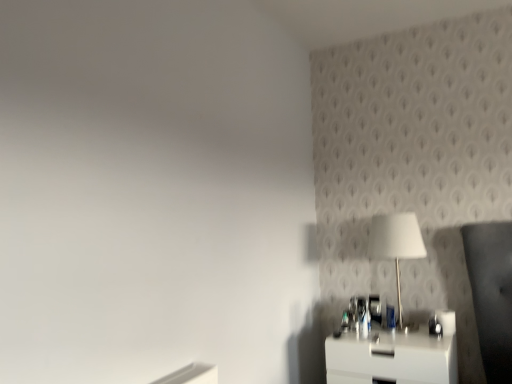
This screenshot has width=512, height=384. In order to click on white glossy nightstand at lower right in this screenshot , I will do coord(391,358).

This screenshot has height=384, width=512. Describe the element at coordinates (391, 358) in the screenshot. I see `white glossy nightstand at lower right` at that location.

The height and width of the screenshot is (384, 512). What do you see at coordinates (396, 241) in the screenshot?
I see `white glossy table lamp at upper right` at bounding box center [396, 241].

Where is `white glossy table lamp at upper right`? The image size is (512, 384). white glossy table lamp at upper right is located at coordinates (396, 241).

The image size is (512, 384). In order to click on white glossy nightstand at lower right in this screenshot , I will do `click(391, 358)`.

In the scene shown: Visually, is white glossy nightstand at lower right positioned to the left or to the right of white glossy table lamp at upper right?

In the image, white glossy nightstand at lower right appears on the left side of white glossy table lamp at upper right.

Is white glossy nightstand at lower right in front of white glossy table lamp at upper right?

Yes, the depth of white glossy nightstand at lower right is less than that of white glossy table lamp at upper right.

Which point is more distant from viewer, (451, 377) or (406, 223)?

Point (406, 223)

From the image's perspective, does white glossy nightstand at lower right appear higher than white glossy table lamp at upper right?

No, from the image's perspective, white glossy nightstand at lower right is not on top of white glossy table lamp at upper right.

From a real-world perspective, is white glossy nightstand at lower right located higher than white glossy table lamp at upper right?

No.

Which of these two, white glossy nightstand at lower right or white glossy table lamp at upper right, is wider?

white glossy nightstand at lower right.

Who is taller, white glossy nightstand at lower right or white glossy table lamp at upper right?

white glossy table lamp at upper right.

Between white glossy nightstand at lower right and white glossy table lamp at upper right, which one has smaller size?

Smaller between the two is white glossy table lamp at upper right.

Would you say white glossy nightstand at lower right is outside white glossy table lamp at upper right?

That's correct, white glossy nightstand at lower right is outside of white glossy table lamp at upper right.

Based on the photo, is white glossy nightstand at lower right touching white glossy table lamp at upper right?

white glossy nightstand at lower right and white glossy table lamp at upper right are clearly separated.

Is white glossy nightstand at lower right looking in the opposite direction of white glossy table lamp at upper right?

No, white glossy table lamp at upper right is not at the back of white glossy nightstand at lower right.

What's the angular difference between white glossy nightstand at lower right and white glossy table lamp at upper right's facing directions?

white glossy nightstand at lower right and white glossy table lamp at upper right are facing 0.987 degrees away from each other.

The image size is (512, 384). In order to click on nightstand in front of the white glossy table lamp at upper right in this screenshot , I will do `click(391, 358)`.

Can you confirm if white glossy table lamp at upper right is positioned to the left of white glossy nightstand at lower right?

In fact, white glossy table lamp at upper right is to the right of white glossy nightstand at lower right.

Considering the relative positions of white glossy table lamp at upper right and white glossy nightstand at lower right in the image provided, is white glossy table lamp at upper right in front of white glossy nightstand at lower right?

No, it is behind white glossy nightstand at lower right.

Which is nearer, (392, 220) or (398, 372)?

Point (392, 220) is positioned farther from the camera compared to point (398, 372).

From the image's perspective, between white glossy table lamp at upper right and white glossy nightstand at lower right, which one is located above?

white glossy table lamp at upper right, from the image's perspective.

From a real-world perspective, is white glossy table lamp at upper right above or below white glossy nightstand at lower right?

In terms of real-world spatial position, white glossy table lamp at upper right is above white glossy nightstand at lower right.

Between white glossy table lamp at upper right and white glossy nightstand at lower right, which one has larger width?

white glossy nightstand at lower right.

Consider the image. Between white glossy table lamp at upper right and white glossy nightstand at lower right, which one has less height?

With less height is white glossy nightstand at lower right.

Considering the relative sizes of white glossy table lamp at upper right and white glossy nightstand at lower right in the image provided, is white glossy table lamp at upper right smaller than white glossy nightstand at lower right?

Correct, white glossy table lamp at upper right occupies less space than white glossy nightstand at lower right.

Is white glossy table lamp at upper right located outside white glossy nightstand at lower right?

white glossy table lamp at upper right is positioned outside white glossy nightstand at lower right.

Is white glossy table lamp at upper right far from white glossy nightstand at lower right?

No, white glossy table lamp at upper right is not far from white glossy nightstand at lower right.

From the picture: Could you tell me if white glossy table lamp at upper right is facing white glossy nightstand at lower right?

No, white glossy table lamp at upper right does not turn towards white glossy nightstand at lower right.

What's the angular difference between white glossy table lamp at upper right and white glossy nightstand at lower right's facing directions?

The angular difference between white glossy table lamp at upper right and white glossy nightstand at lower right is 0.987 degrees.

Measure the distance from white glossy table lamp at upper right to white glossy nightstand at lower right.

white glossy table lamp at upper right is 20.28 inches away from white glossy nightstand at lower right.

Locate an element on the screen. This screenshot has height=384, width=512. table lamp behind the white glossy nightstand at lower right is located at coordinates (396, 241).

Where is `table lamp that is above the white glossy nightstand at lower right (from a real-world perspective)`? The height and width of the screenshot is (384, 512). table lamp that is above the white glossy nightstand at lower right (from a real-world perspective) is located at coordinates (396, 241).

Find the location of a particular element. nightstand that is in front of the white glossy table lamp at upper right is located at coordinates (391, 358).